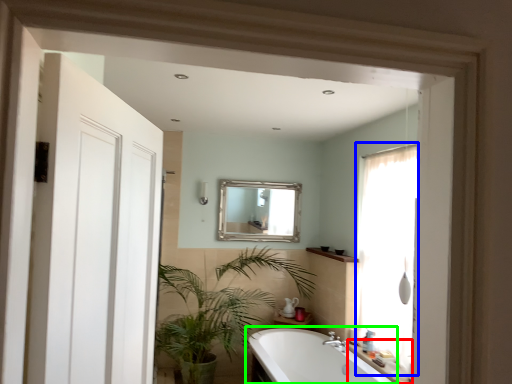
Question: Estimate the real-world distances between objects in this image. Which object is closer to counter top (highlighted by a red box), window (highlighted by a blue box) or bathtub (highlighted by a green box)?

Choices:
 (A) window
 (B) bathtub

Answer: (B)